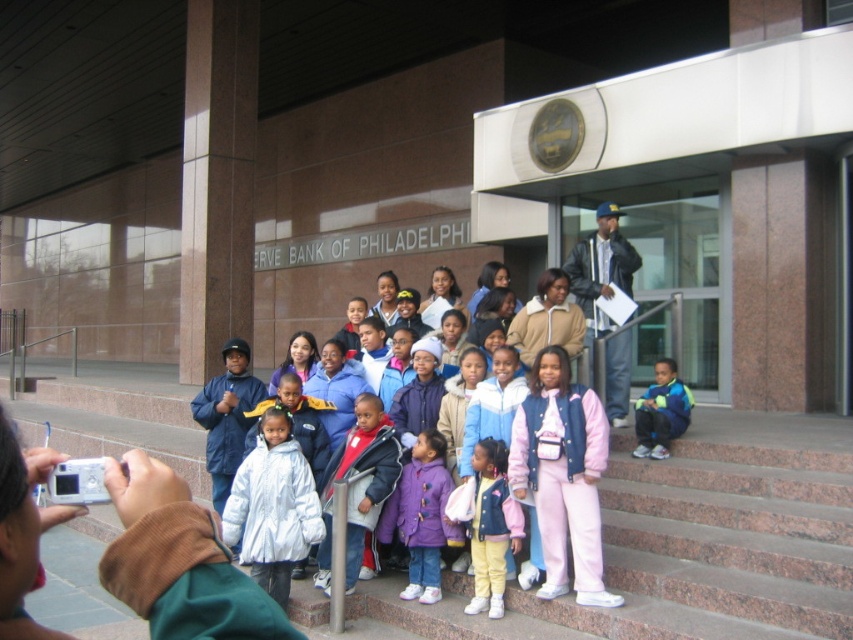
You are a photographer trying to capture the group photo of the children and adults outside the Federal Reserve Bank of Philadelphia. You want to ensure the purple fleece jacket at center is centered in the frame. Based on its 2D coordinates, is it already centered?

The purple fleece jacket at center is located at coordinates point (421, 516), which means it is slightly to the right and bottom of the exact center of the frame. To center it, the photographer should adjust the camera to move the jacket slightly left and upwards.

You are a photographer taking a picture of the group at the Federal Reserve Bank of Philadelphia. You notice two coats in the center of the group. Which one is more visible in the photo, the white shiny coat at center or the purple fleece jacket at center?

The white shiny coat at center is more visible because it is closer to the viewer than the purple fleece jacket at center.